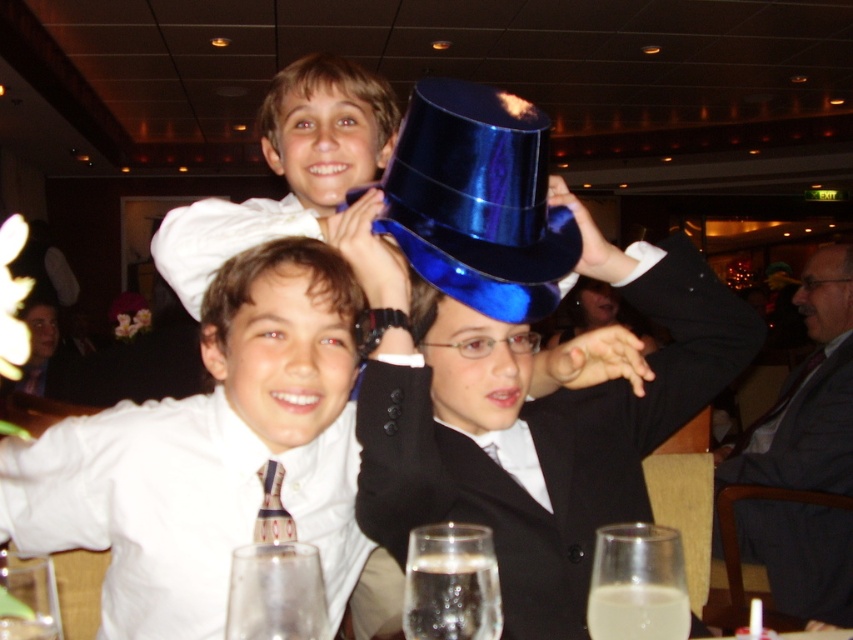
Question: Is gray wool suit at right positioned at the back of gray hair at upper right?

Choices:
 (A) yes
 (B) no

Answer: (B)

Question: Which point is closer to the camera?

Choices:
 (A) patterned silk tie at center
 (B) blue velvet dress hat at upper center

Answer: (A)

Question: Considering the real-world distances, which object is farthest from the gray hair at upper right?

Choices:
 (A) blue velvet dress hat at upper center
 (B) white satin shirt at center
 (C) gray wool suit at right
 (D) patterned silk tie at center

Answer: (D)

Question: Does white satin shirt at center have a larger size compared to gray wool suit at right?

Choices:
 (A) yes
 (B) no

Answer: (B)

Question: Is gray wool suit at right bigger than gray hair at upper right?

Choices:
 (A) yes
 (B) no

Answer: (A)

Question: Estimate the real-world distances between objects in this image. Which object is farther from the matte white shirt at upper center?

Choices:
 (A) blue velvet dress hat at upper center
 (B) white satin shirt at center
 (C) patterned silk tie at center
 (D) matte white shirt at center

Answer: (C)